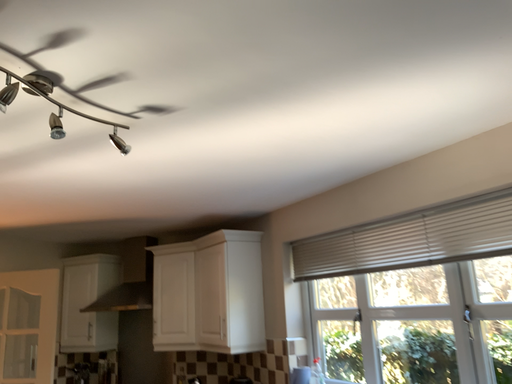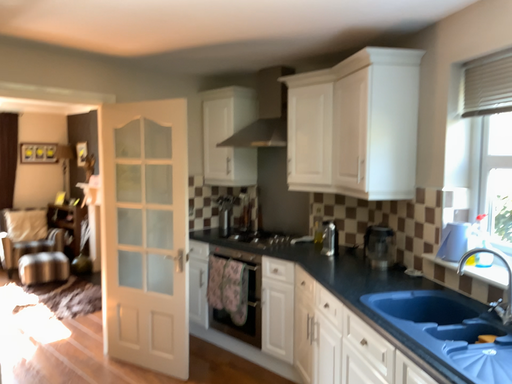
Question: How did the camera likely rotate when shooting the video?

Choices:
 (A) rotated upward
 (B) rotated downward

Answer: (B)